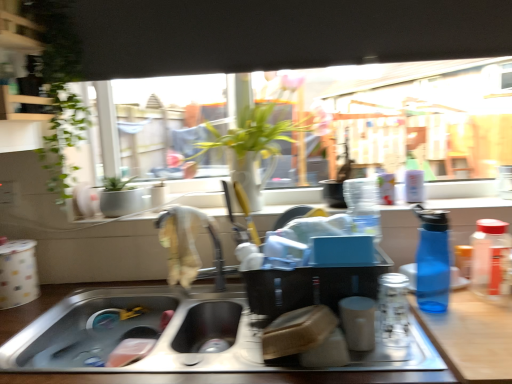
The height and width of the screenshot is (384, 512). What do you see at coordinates (402, 116) in the screenshot?
I see `transparent glass window at center` at bounding box center [402, 116].

In the scene shown: Measure the distance between point (x=487, y=237) and camera.

1.10 meters.

The height and width of the screenshot is (384, 512). What do you see at coordinates (490, 257) in the screenshot? I see `transparent glass jar at right, which appears as the 3th bottle when viewed from the left` at bounding box center [490, 257].

In order to click on wooden counter at lower right in this screenshot , I will do `click(471, 338)`.

Locate an element on the screen. This screenshot has height=384, width=512. green leafy plant at center is located at coordinates (252, 146).

The height and width of the screenshot is (384, 512). In order to click on transparent glass window at center in this screenshot , I will do coord(402,116).

Considering the positions of objects transparent glass jar at right, arranged as the first bottle when viewed from the right, and stainless steel sink at lower center in the image provided, who is behind, transparent glass jar at right, arranged as the first bottle when viewed from the right, or stainless steel sink at lower center?

transparent glass jar at right, arranged as the first bottle when viewed from the right, is further from the camera.

In terms of width, does transparent glass jar at right, which appears as the 3th bottle when viewed from the left, look wider or thinner when compared to stainless steel sink at lower center?

transparent glass jar at right, which appears as the 3th bottle when viewed from the left, is thinner than stainless steel sink at lower center.

From a real-world perspective, is transparent glass jar at right, which appears as the 3th bottle when viewed from the left, beneath stainless steel sink at lower center?

No, from a real-world perspective, transparent glass jar at right, which appears as the 3th bottle when viewed from the left, is not under stainless steel sink at lower center.

Does point (504, 283) appear closer or farther from the camera than point (420, 377)?

Point (504, 283) is farther from the camera than point (420, 377).

Is there a large distance between matte black container at center and silver metallic faucet at center?

matte black container at center is actually quite close to silver metallic faucet at center.

From the image's perspective, is matte black container at center located above or below silver metallic faucet at center?

matte black container at center is situated lower than silver metallic faucet at center in the image.

Considering the positions of objects matte black container at center and silver metallic faucet at center in the image provided, who is behind, matte black container at center or silver metallic faucet at center?

silver metallic faucet at center is further from the camera.

Does matte black container at center turn towards silver metallic faucet at center?

No, matte black container at center does not turn towards silver metallic faucet at center.

Which object is positioned more to the left, stainless steel sink at lower center or blue translucent bottle at right, which appears as the 2th bottle when viewed from the right?

stainless steel sink at lower center is more to the left.

Does stainless steel sink at lower center have a lesser height compared to blue translucent bottle at right, which appears as the 2th bottle when viewed from the right?

Correct, stainless steel sink at lower center is not as tall as blue translucent bottle at right, which appears as the 2th bottle when viewed from the right.

Based on the photo, from the image's perspective, is matte black container at center above or below blue translucent bottle at right, which appears as the 2th bottle when viewed from the right?

From the image's perspective, matte black container at center appears below blue translucent bottle at right, which appears as the 2th bottle when viewed from the right.

In the scene shown: Does matte black container at center have a larger size compared to blue translucent bottle at right, which appears as the 2th bottle when viewed from the right?

Indeed, matte black container at center has a larger size compared to blue translucent bottle at right, which appears as the 2th bottle when viewed from the right.

Is matte black container at center at the left side of blue translucent bottle at right, which is the second bottle from left to right?

Yes, matte black container at center is to the left of blue translucent bottle at right, which is the second bottle from left to right.

From a real-world perspective, is matte black container at center positioned above or below blue translucent bottle at right, which is the second bottle from left to right?

matte black container at center is situated lower than blue translucent bottle at right, which is the second bottle from left to right, in the real world.

Based on the photo, from the image's perspective, is stainless steel sink at lower center positioned above or below transparent glass window at center?

From the image's perspective, stainless steel sink at lower center appears below transparent glass window at center.

In terms of height, does stainless steel sink at lower center look taller or shorter compared to transparent glass window at center?

Clearly, stainless steel sink at lower center is shorter compared to transparent glass window at center.

Who is more distant, stainless steel sink at lower center or transparent glass window at center?

transparent glass window at center is further away from the camera.

Is stainless steel sink at lower center bigger than transparent glass window at center?

No.

Is blue translucent bottle at right, which is the second bottle from left to right, bigger or smaller than transparent glass window at center?

Considering their sizes, blue translucent bottle at right, which is the second bottle from left to right, takes up less space than transparent glass window at center.

Considering the relative sizes of blue translucent bottle at right, which is the second bottle from left to right, and transparent glass window at center in the image provided, is blue translucent bottle at right, which is the second bottle from left to right, taller than transparent glass window at center?

In fact, blue translucent bottle at right, which is the second bottle from left to right, may be shorter than transparent glass window at center.

Which object is wider, blue translucent bottle at right, which is the second bottle from left to right, or transparent glass window at center?

blue translucent bottle at right, which is the second bottle from left to right.

From a real-world perspective, is blue translucent bottle at right, which is the second bottle from left to right, positioned above or below transparent glass window at center?

→ blue translucent bottle at right, which is the second bottle from left to right, is situated lower than transparent glass window at center in the real world.

From a real-world perspective, who is located lower, clear glass jar at center, acting as the 1th bottle starting from the left, or green leafy plant at center?

In real-world perspective, clear glass jar at center, acting as the 1th bottle starting from the left, is lower.

Looking at this image, is green leafy plant at center a part of clear glass jar at center, the 3th bottle in the right-to-left sequence?

No, green leafy plant at center is not a part of clear glass jar at center, the 3th bottle in the right-to-left sequence.

Which bottle is the 3rd one when counting from the front of the green leafy plant at center? Please provide its 2D coordinates.

[(394, 309)]

Consider the image. Is clear glass jar at center, the 3th bottle in the right-to-left sequence, to the left or to the right of green leafy plant at center in the image?

From the image, it's evident that clear glass jar at center, the 3th bottle in the right-to-left sequence, is to the right of green leafy plant at center.

Locate an element on the screen. the 3rd bottle counting from the right of the stainless steel sink at lower center is located at coordinates [490, 257].

You are a GUI agent. You are given a task and a screenshot of the screen. Output one action in this format:
    pyautogui.click(x=<x>, y=<y>)
    Task: Click on the appliance directly beneath the silver metallic faucet at center (from a real-world perspective)
    
    Given the screenshot: What is the action you would take?
    pyautogui.click(x=311, y=286)

Looking at this image, which object lies further to the anchor point silver metallic faucet at center, green leafy plant at center or blue translucent bottle at right, which is the second bottle from left to right?

blue translucent bottle at right, which is the second bottle from left to right.

Consider the image. Estimate the real-world distances between objects in this image. Which object is further from transparent glass window at center, green leafy plant at center or wooden counter at lower right?

Among the two, wooden counter at lower right is located further to transparent glass window at center.

Which object lies further to the anchor point stainless steel sink at lower center, matte black container at center or green leafy plant at center?

green leafy plant at center lies further to stainless steel sink at lower center than the other object.

Based on their spatial positions, is blue translucent bottle at right, which appears as the 2th bottle when viewed from the right, or stainless steel sink at lower center closer to silver metallic faucet at center?

stainless steel sink at lower center is positioned closer to the anchor silver metallic faucet at center.

In the scene shown: When comparing their distances from blue translucent bottle at right, which appears as the 2th bottle when viewed from the right, does wooden counter at lower right or transparent glass jar at right, which appears as the 3th bottle when viewed from the left, seem closer?

wooden counter at lower right.

When comparing their distances from silver metallic faucet at center, does green leafy plant at center or stainless steel sink at lower center seem further?

stainless steel sink at lower center is further to silver metallic faucet at center.

Considering their positions, is green leafy plant at center positioned closer to stainless steel sink at lower center than clear glass jar at center, the 3th bottle in the right-to-left sequence?

The object closer to stainless steel sink at lower center is clear glass jar at center, the 3th bottle in the right-to-left sequence.

Considering their positions, is clear glass jar at center, the 3th bottle in the right-to-left sequence, positioned further to green leafy plant at center than wooden counter at lower right?

The object further to green leafy plant at center is wooden counter at lower right.

Identify the location of appliance between stainless steel sink at lower center and clear glass jar at center, the 3th bottle in the right-to-left sequence, in the horizontal direction. (311, 286).

At what (x,y) coordinates should I click in order to perform the action: click on window between stainless steel sink at lower center and transparent glass jar at right, arranged as the first bottle when viewed from the right, in the horizontal direction. Please return your answer as a coordinate pair (x, y). This screenshot has height=384, width=512. Looking at the image, I should click on (402, 116).

The width and height of the screenshot is (512, 384). What are the coordinates of `appliance between green leafy plant at center and stainless steel sink at lower center in the up-down direction` in the screenshot? It's located at (311, 286).

You are a GUI agent. You are given a task and a screenshot of the screen. Output one action in this format:
    pyautogui.click(x=<x>, y=<y>)
    Task: Click on the houseplant located between stainless steel sink at lower center and blue translucent bottle at right, which appears as the 2th bottle when viewed from the right, in the left-right direction
    This screenshot has height=384, width=512.
    Given the screenshot: What is the action you would take?
    pyautogui.click(x=252, y=146)